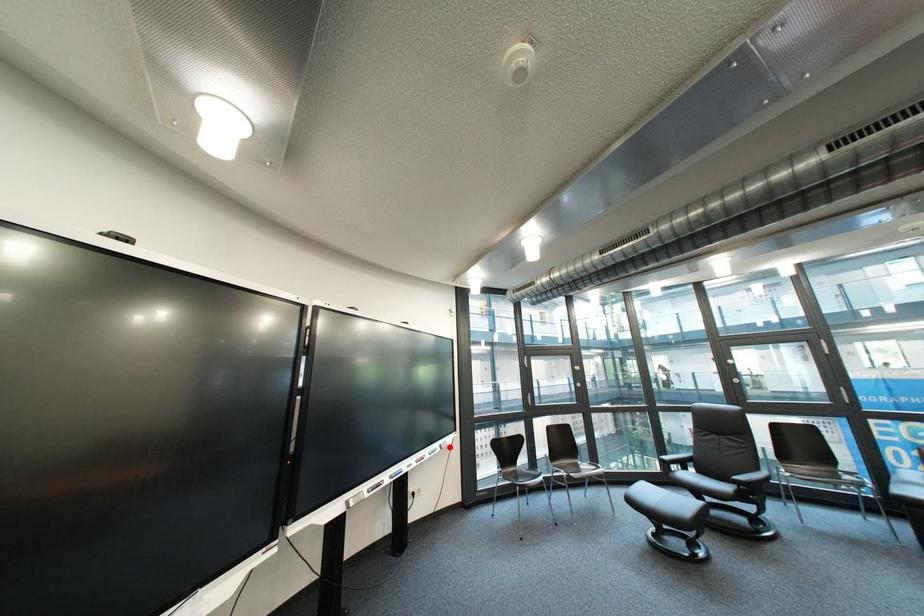
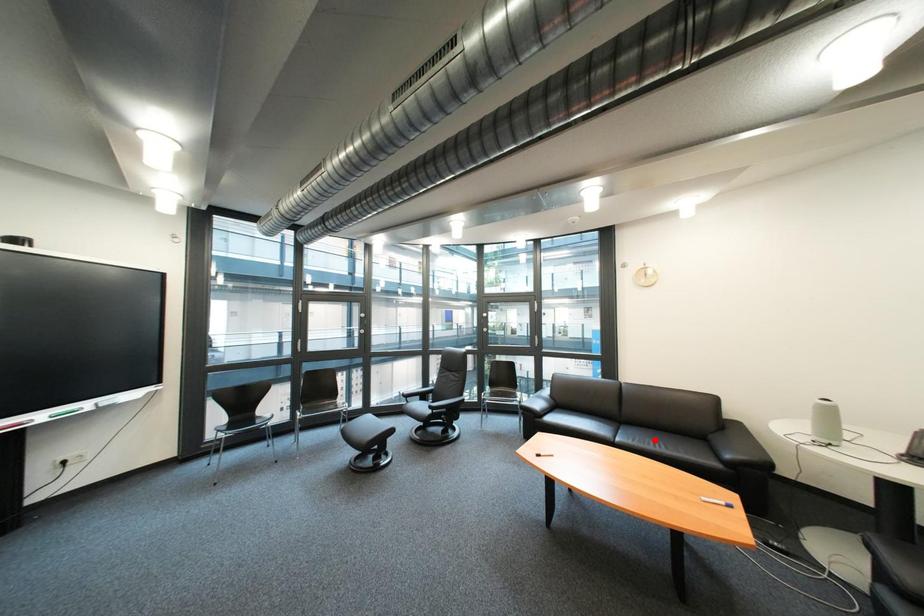
In the scene shown: I am providing you with two images of the same scene from different viewpoints. A red point is marked on the first image and another point is marked on the second image. Is the red point in image1 aligned with the point shown in image2?

No